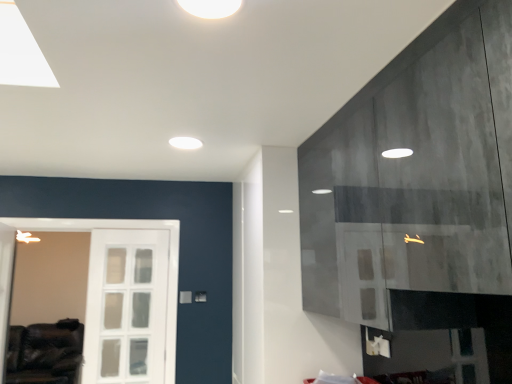
Question: Is white matte light fixture at upper center, which ranks as the second lighting in bottom-to-top order, turned away from leather couch at lower left?

Choices:
 (A) no
 (B) yes

Answer: (A)

Question: Is white matte light fixture at upper center, which appears as the second lighting when viewed from the back, further to the viewer compared to leather couch at lower left?

Choices:
 (A) yes
 (B) no

Answer: (B)

Question: Is leather couch at lower left inside white matte light fixture at upper center, which ranks as the second lighting in bottom-to-top order?

Choices:
 (A) yes
 (B) no

Answer: (B)

Question: Is there a large distance between white matte light fixture at upper center, which ranks as the second lighting in bottom-to-top order, and leather couch at lower left?

Choices:
 (A) yes
 (B) no

Answer: (A)

Question: From a real-world perspective, is white matte light fixture at upper center, which appears as the second lighting when viewed from the back, located beneath leather couch at lower left?

Choices:
 (A) no
 (B) yes

Answer: (A)

Question: Is white matte light fixture at upper center, the 2th lighting when ordered from left to right, in front of leather couch at lower left?

Choices:
 (A) yes
 (B) no

Answer: (A)

Question: Is leather couch at lower left completely or partially outside of white matte light fixture at upper center, the 1th lighting positioned from the right?

Choices:
 (A) no
 (B) yes

Answer: (B)

Question: Considering the relative positions of leather couch at lower left and white matte light fixture at upper center, which appears as the second lighting when viewed from the back, in the image provided, is leather couch at lower left to the left of white matte light fixture at upper center, which appears as the second lighting when viewed from the back, from the viewer's perspective?

Choices:
 (A) no
 (B) yes

Answer: (B)

Question: Could white matte light fixture at upper center, acting as the first lighting starting from the top, be considered to be inside leather couch at lower left?

Choices:
 (A) yes
 (B) no

Answer: (B)

Question: Is leather couch at lower left oriented away from white matte light fixture at upper center, acting as the first lighting starting from the top?

Choices:
 (A) no
 (B) yes

Answer: (A)

Question: From the image's perspective, is leather couch at lower left under white matte light fixture at upper center, the 2th lighting when ordered from left to right?

Choices:
 (A) yes
 (B) no

Answer: (A)

Question: Considering the relative sizes of leather couch at lower left and white matte light fixture at upper center, acting as the first lighting starting from the top, in the image provided, is leather couch at lower left smaller than white matte light fixture at upper center, acting as the first lighting starting from the top,?

Choices:
 (A) yes
 (B) no

Answer: (B)

Question: Does white matte light fixture at upper center, which ranks as the second lighting in bottom-to-top order, lie behind white matte ceiling light at upper center, which ranks as the 1th lighting in bottom-to-top order?

Choices:
 (A) yes
 (B) no

Answer: (B)